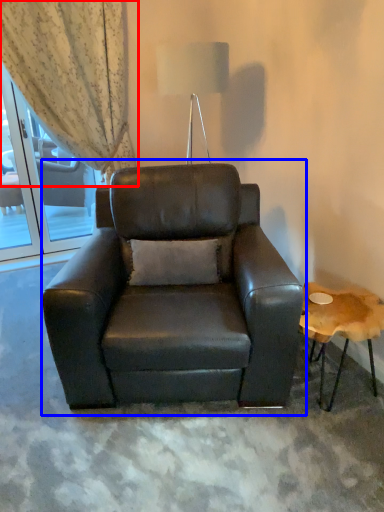
Question: Which object appears farthest to the camera in this image, curtain (highlighted by a red box) or chair (highlighted by a blue box)?

Choices:
 (A) curtain
 (B) chair

Answer: (A)